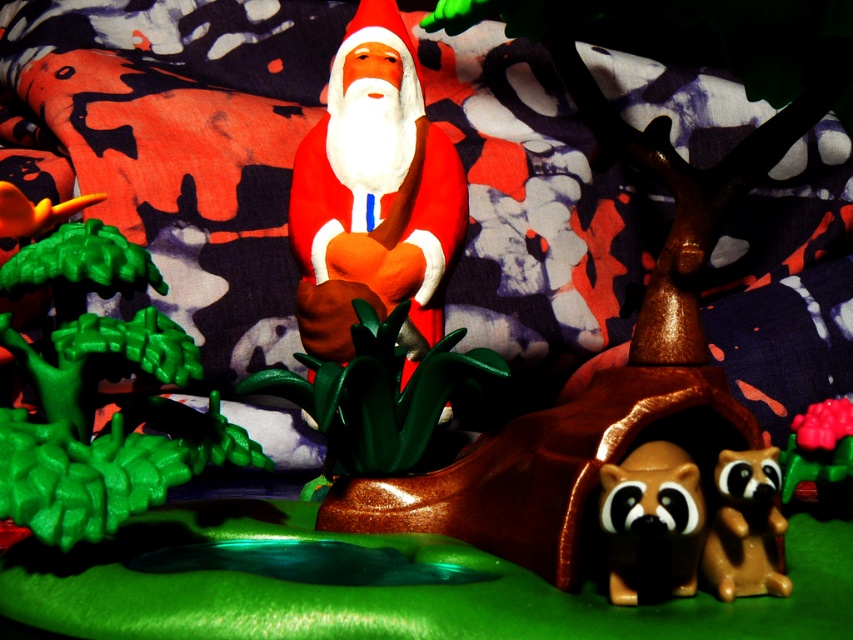
You are organizing a display and need to place both the brown matte raccoon at lower right and the brown glossy raccoon at lower right on a shelf. The shelf has limited space, and you want to arrange them so that the smaller one is closer to the edge to prevent it from being knocked over. Which raccoon should you place closer to the edge?

The brown glossy raccoon at lower right should be placed closer to the edge since it is smaller than the brown matte raccoon at lower right.

You are a toy collector who wants to display the matte plastic santa at center and the brown matte raccoon at lower right on a shelf. If the shelf has limited vertical space, which toy should you place first to ensure it fits?

The brown matte raccoon at lower right should be placed first since it is shorter than the matte plastic santa at center, allowing it to fit into the limited vertical space more easily.

What are the coordinates of the brown matte raccoon at lower right in the image?

The brown matte raccoon at lower right is located at coordinates point (653, 518).